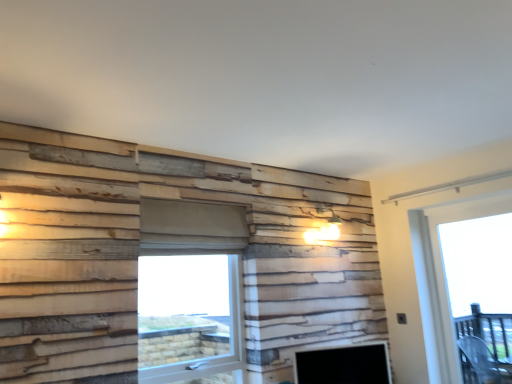
Question: Should I look upward or downward to see transparent plastic window screen at center?

Choices:
 (A) up
 (B) down

Answer: (B)

Question: Does transparent plastic window screen at center have a greater height compared to transparent glass door at right?

Choices:
 (A) yes
 (B) no

Answer: (B)

Question: Would you say transparent glass door at right is part of transparent plastic window screen at center's contents?

Choices:
 (A) yes
 (B) no

Answer: (B)

Question: Would you say transparent plastic window screen at center is a long distance from transparent glass door at right?

Choices:
 (A) no
 (B) yes

Answer: (B)

Question: Is transparent plastic window screen at center wider than transparent glass door at right?

Choices:
 (A) yes
 (B) no

Answer: (A)

Question: Is transparent plastic window screen at center facing away from transparent glass door at right?

Choices:
 (A) no
 (B) yes

Answer: (A)

Question: From a real-world perspective, is transparent plastic window screen at center positioned over transparent glass door at right based on gravity?

Choices:
 (A) yes
 (B) no

Answer: (B)

Question: Does transparent glass door at right have a greater height compared to matte black fireplace at lower center?

Choices:
 (A) yes
 (B) no

Answer: (A)

Question: Can we say transparent glass door at right lies outside matte black fireplace at lower center?

Choices:
 (A) no
 (B) yes

Answer: (B)

Question: Could you tell me if transparent glass door at right is turned towards matte black fireplace at lower center?

Choices:
 (A) yes
 (B) no

Answer: (A)

Question: From the image's perspective, is transparent glass door at right on top of matte black fireplace at lower center?

Choices:
 (A) yes
 (B) no

Answer: (A)

Question: Is matte black fireplace at lower center located within transparent glass door at right?

Choices:
 (A) yes
 (B) no

Answer: (B)

Question: Is transparent glass door at right looking in the opposite direction of matte black fireplace at lower center?

Choices:
 (A) yes
 (B) no

Answer: (B)

Question: Would you say transparent plastic window screen at center is outside matte black fireplace at lower center?

Choices:
 (A) no
 (B) yes

Answer: (B)